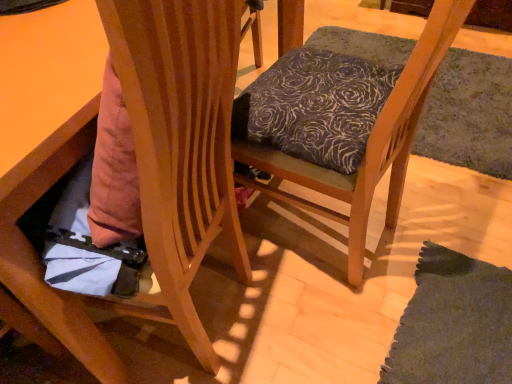
Question: Is point (449, 26) positioned closer to the camera than point (169, 119)?

Choices:
 (A) closer
 (B) farther

Answer: (B)

Question: Would you say textured fabric cushion at center, positioned as the 2th chair in left-to-right order, is to the left or to the right of wooden chair at lower left, which is counted as the second chair, starting from the right, in the picture?

Choices:
 (A) left
 (B) right

Answer: (B)

Question: Considering their positions, is textured fabric cushion at center, the first chair when ordered from right to left, located in front of or behind wooden chair at lower left, which is counted as the second chair, starting from the right?

Choices:
 (A) front
 (B) behind

Answer: (B)

Question: From a real-world perspective, is wooden chair at lower left, which is counted as the second chair, starting from the right, positioned above or below textured fabric cushion at center, the first chair when ordered from right to left?

Choices:
 (A) above
 (B) below

Answer: (B)

Question: Is point (76, 339) positioned closer to the camera than point (365, 221)?

Choices:
 (A) farther
 (B) closer

Answer: (B)

Question: From their relative heights in the image, would you say wooden chair at lower left, positioned as the 1th chair in left-to-right order, is taller or shorter than textured fabric cushion at center, positioned as the 2th chair in left-to-right order?

Choices:
 (A) tall
 (B) short

Answer: (B)

Question: Is wooden chair at lower left, which is counted as the second chair, starting from the right, inside the boundaries of textured fabric cushion at center, positioned as the 2th chair in left-to-right order, or outside?

Choices:
 (A) outside
 (B) inside

Answer: (A)